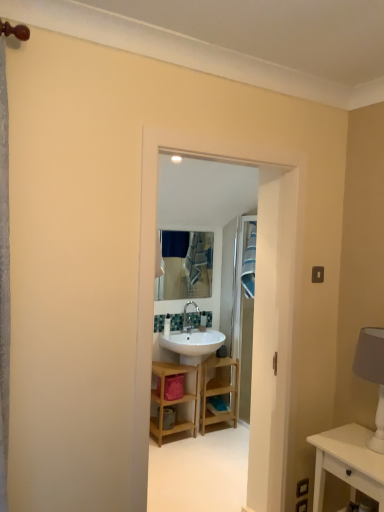
Question: Should I look upward or downward to see white fabric lampshade at right?

Choices:
 (A) down
 (B) up

Answer: (A)

Question: Can you confirm if wooden shelf at center is thinner than metallic silver mirror at center?

Choices:
 (A) no
 (B) yes

Answer: (A)

Question: From the image's perspective, is wooden shelf at center located beneath metallic silver mirror at center?

Choices:
 (A) yes
 (B) no

Answer: (A)

Question: From a real-world perspective, is wooden shelf at center on metallic silver mirror at center?

Choices:
 (A) no
 (B) yes

Answer: (A)

Question: Is wooden shelf at center further to camera compared to metallic silver mirror at center?

Choices:
 (A) yes
 (B) no

Answer: (B)

Question: Does wooden shelf at center turn towards metallic silver mirror at center?

Choices:
 (A) yes
 (B) no

Answer: (B)

Question: Is wooden shelf at center beside metallic silver mirror at center?

Choices:
 (A) no
 (B) yes

Answer: (A)

Question: Does white fabric lampshade at right have a greater height compared to blue fabric laundry at center?

Choices:
 (A) no
 (B) yes

Answer: (A)

Question: Can you confirm if white fabric lampshade at right is thinner than blue fabric laundry at center?

Choices:
 (A) yes
 (B) no

Answer: (B)

Question: From a real-world perspective, is white fabric lampshade at right positioned over blue fabric laundry at center based on gravity?

Choices:
 (A) no
 (B) yes

Answer: (A)

Question: Is white fabric lampshade at right positioned before blue fabric laundry at center?

Choices:
 (A) yes
 (B) no

Answer: (A)

Question: Could blue fabric laundry at center be considered to be inside white fabric lampshade at right?

Choices:
 (A) yes
 (B) no

Answer: (B)

Question: Does white fabric lampshade at right have a larger size compared to blue fabric laundry at center?

Choices:
 (A) yes
 (B) no

Answer: (A)

Question: Is wooden shelf at center smaller than white glossy sink at center?

Choices:
 (A) no
 (B) yes

Answer: (B)